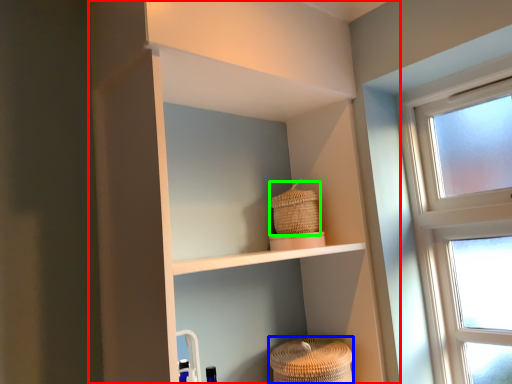
Question: Considering the real-world distances, which object is farthest from shelf (highlighted by a red box)? basket (highlighted by a blue box) or basket (highlighted by a green box)?

Choices:
 (A) basket
 (B) basket

Answer: (A)